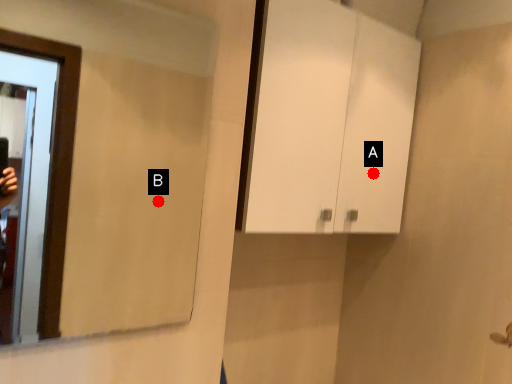
Question: Two points are circled on the image, labeled by A and B beside each circle. Among these points, which one is nearest to the camera?

Choices:
 (A) A is closer
 (B) B is closer

Answer: (A)